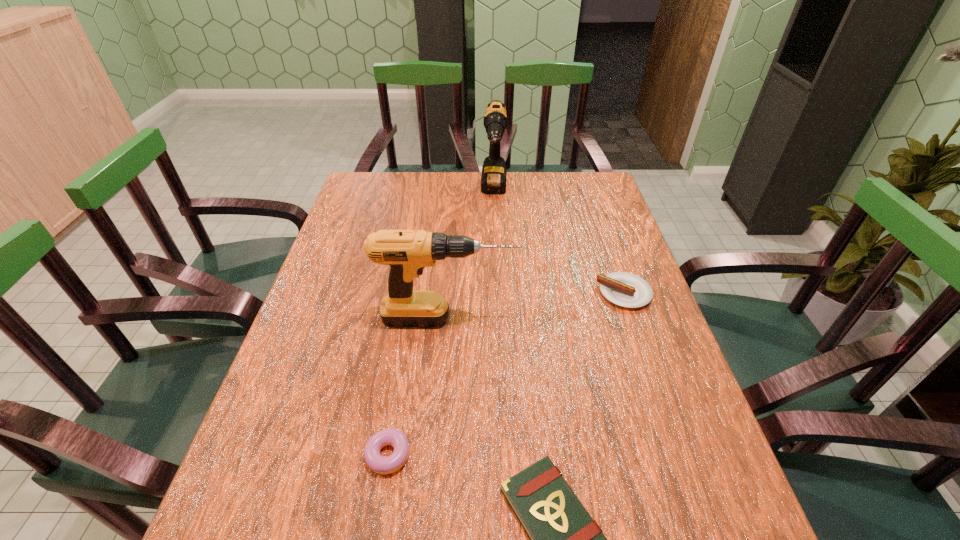
Identify which object is located as the second nearest to the rightmost object. Please provide its 2D coordinates. Your answer should be formatted as a tuple, i.e. [(x, y)], where the tuple contains the x and y coordinates of a point satisfying the conditions above.

[(493, 179)]

Identify the location of vacant area that satisfies the following two spatial constraints: 1. at the tip of the farther drill; 2. at the tip of the nearer drill. This screenshot has width=960, height=540. tap(500, 319).

At what (x,y) coordinates should I click in order to perform the action: click on vacant space that satisfies the following two spatial constraints: 1. at the tip of the farthest object; 2. at the tip of the nearer drill. Please return your answer as a coordinate pair (x, y). The width and height of the screenshot is (960, 540). Looking at the image, I should click on (500, 319).

Locate an element on the screen. Image resolution: width=960 pixels, height=540 pixels. vacant region that satisfies the following two spatial constraints: 1. on the back side of the rightmost object; 2. on the left side of the doughnut is located at coordinates (414, 293).